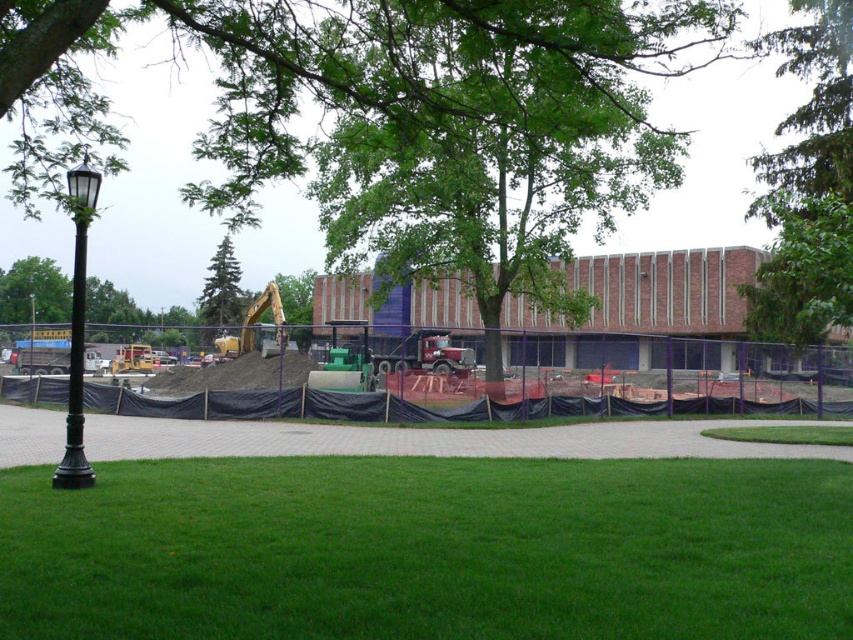
Who is taller, green textured pine tree at upper left or green leafy tree at center?

green textured pine tree at upper left is taller.

Identify the location of green textured pine tree at upper left. Image resolution: width=853 pixels, height=640 pixels. (222, 289).

The image size is (853, 640). Find the location of `green textured pine tree at upper left`. green textured pine tree at upper left is located at coordinates (222, 289).

Who is higher up, black asphalt construction site at center or green leafy tree at left?

Positioned higher is green leafy tree at left.

Does black asphalt construction site at center appear under green leafy tree at left?

Yes, black asphalt construction site at center is below green leafy tree at left.

Is point (271, 396) farther from viewer compared to point (39, 296)?

That is False.

Locate an element on the screen. This screenshot has height=640, width=853. black asphalt construction site at center is located at coordinates (639, 400).

Looking at this image, can you confirm if green leafy tree at upper center is positioned to the left of black polished lamp post at left?

Incorrect, green leafy tree at upper center is not on the left side of black polished lamp post at left.

The height and width of the screenshot is (640, 853). Describe the element at coordinates (808, 186) in the screenshot. I see `green leafy tree at upper center` at that location.

You are a GUI agent. You are given a task and a screenshot of the screen. Output one action in this format:
    pyautogui.click(x=<x>, y=<y>)
    Task: Click on the green leafy tree at upper center
    This screenshot has width=853, height=640.
    Given the screenshot: What is the action you would take?
    pyautogui.click(x=808, y=186)